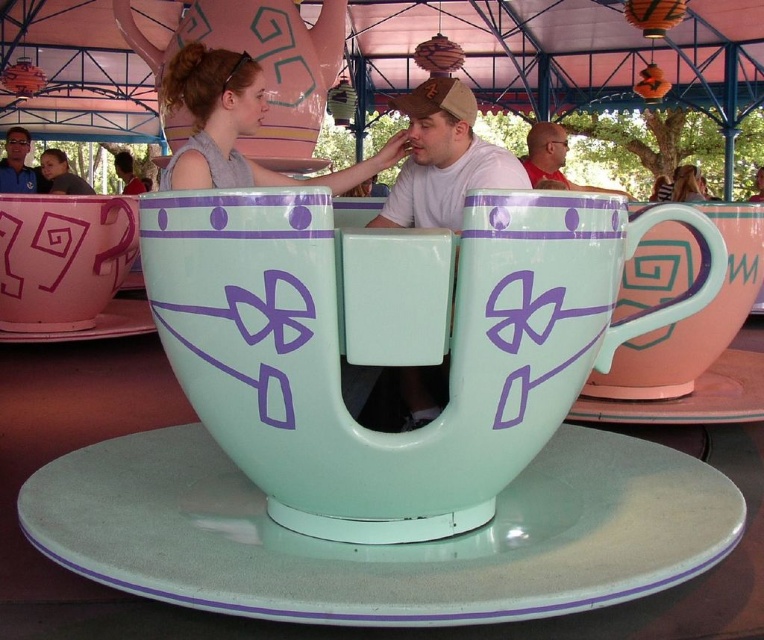
You are standing at the center of the carousel structure and see the point labeled as point (94, 324). What object is located at that point?

The point (94, 324) corresponds to the matte pink saucer at lower left.

You are standing at the entrance of the amusement park ride and want to locate the glossy ceramic saucer at center. According to the coordinates provided, where would you find it in the image?

The glossy ceramic saucer at center is located at coordinates point (384, 545) in the image.

You are a photographer taking a picture of the red shirt at upper center and the matte gray hair at upper center. Which one is on the left side in the photo?

The red shirt at upper center is positioned on the left side of matte gray hair at upper center, so in the photo, the red shirt at upper center will be on the left side.